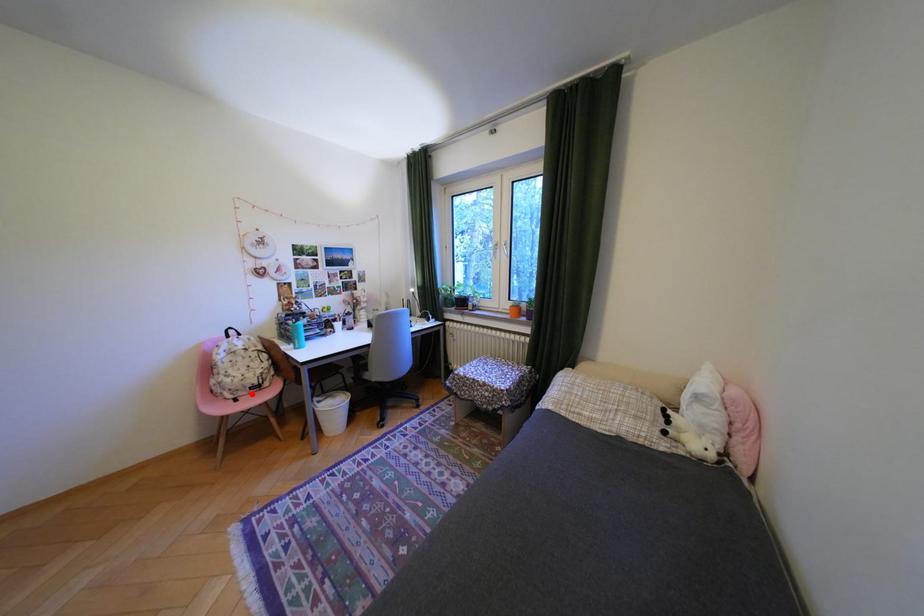
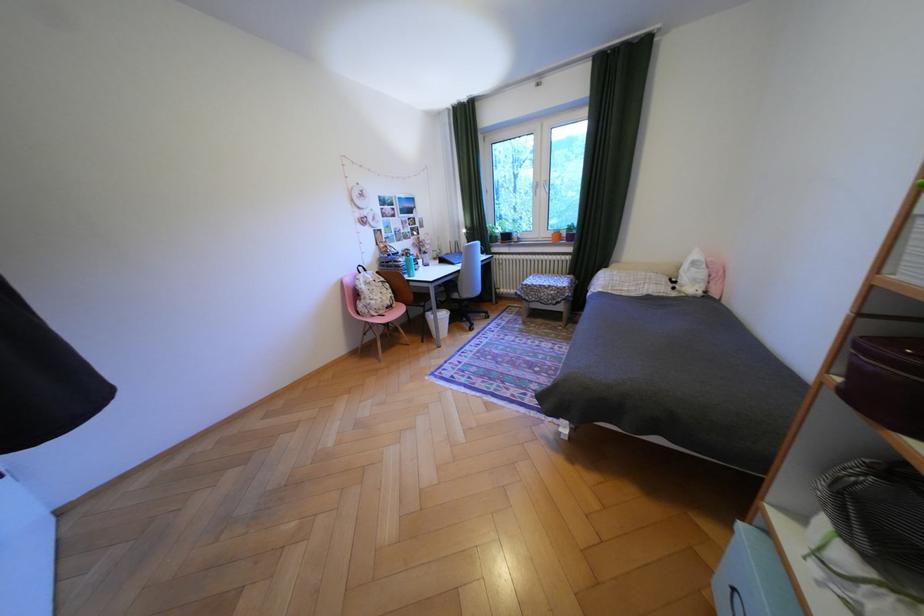
Locate, in the second image, the point that corresponds to the highlighted location in the first image.

(393, 312)